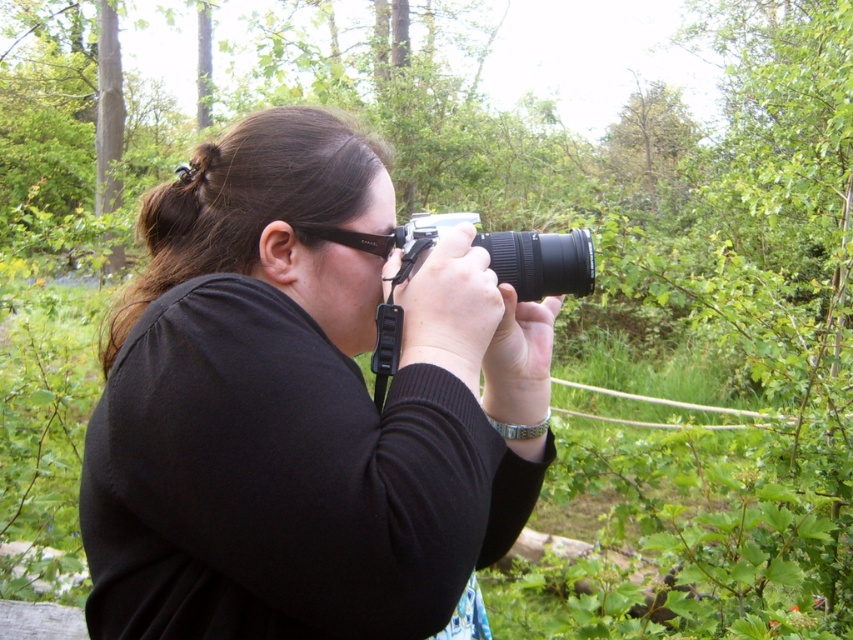
You are a photographer holding two cameras around your neck. You need to quickly switch between the black matte camera at center and the black plastic camera at center. How much space is there between them for you to maneuver?

There is a distance of 8.32 inches between the black matte camera at center and the black plastic camera at center, providing sufficient space to maneuver between them.